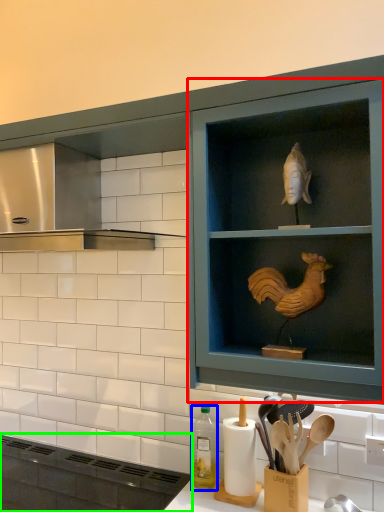
Question: Estimate the real-world distances between objects in this image. Which object is farther from shelf (highlighted by a red box), bottle (highlighted by a blue box) or appliance (highlighted by a green box)?

Choices:
 (A) bottle
 (B) appliance

Answer: (B)